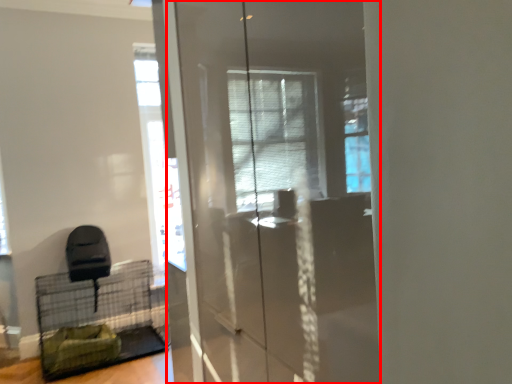
Question: From the image's perspective, what is the correct spatial relationship of screen door (annotated by the red box) in relation to bird cage?

Choices:
 (A) above
 (B) below

Answer: (A)